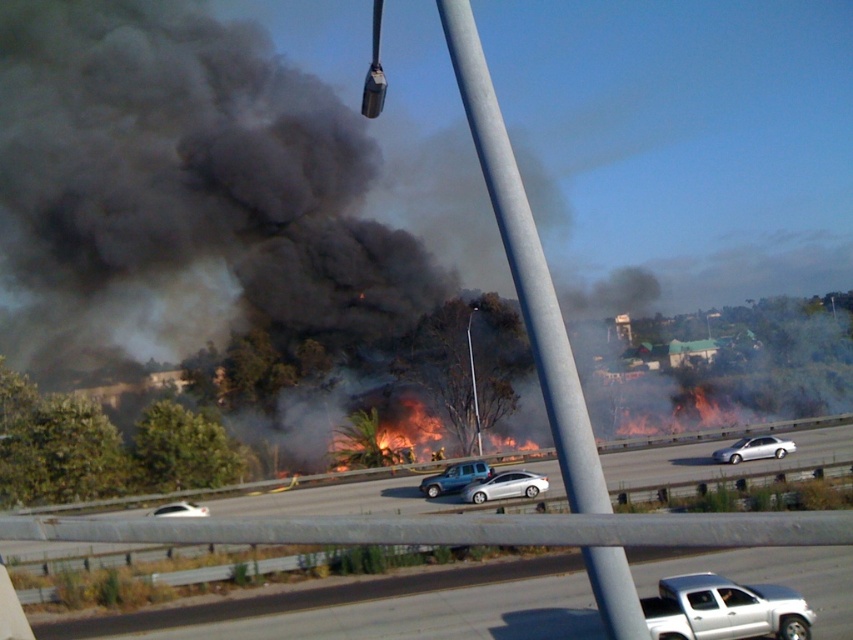
You are a driver on the highway and need to choose between two escape routes marked by point 1 at point (x=460, y=484) and point 2 at point (x=469, y=339). Based on their positions, which point is closer to you and thus safer to head towards?

Point 1 at point (x=460, y=484) is closer to the viewer than point 2 at point (x=469, y=339), so it is safer to head towards point 1 at point (x=460, y=484).

You are a driver trying to escape the wildfire. You see a satin silver suv at center. Based on its position, can you determine if it is on the same side of the road as you?

The satin silver suv at center is located at coordinates point [454,477], which places it on the same side of the road as you. Therefore, you can safely assume it is on your side.